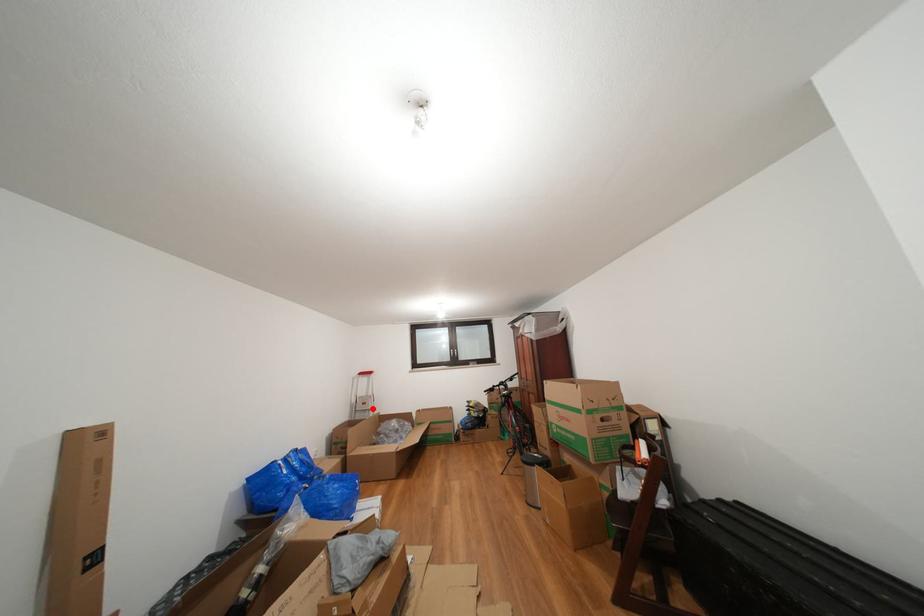
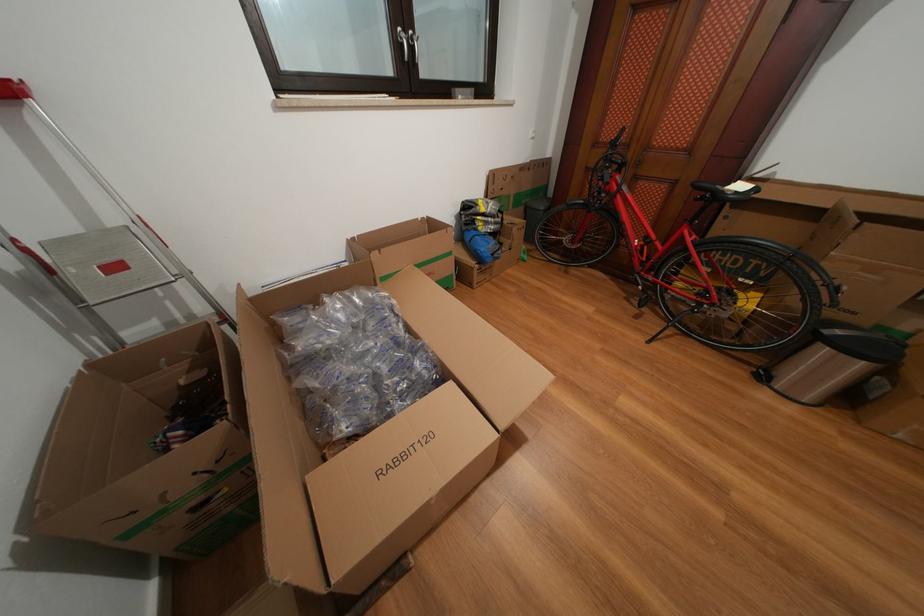
In the second image, find the point that corresponds to the highlighted location in the first image.

(124, 273)